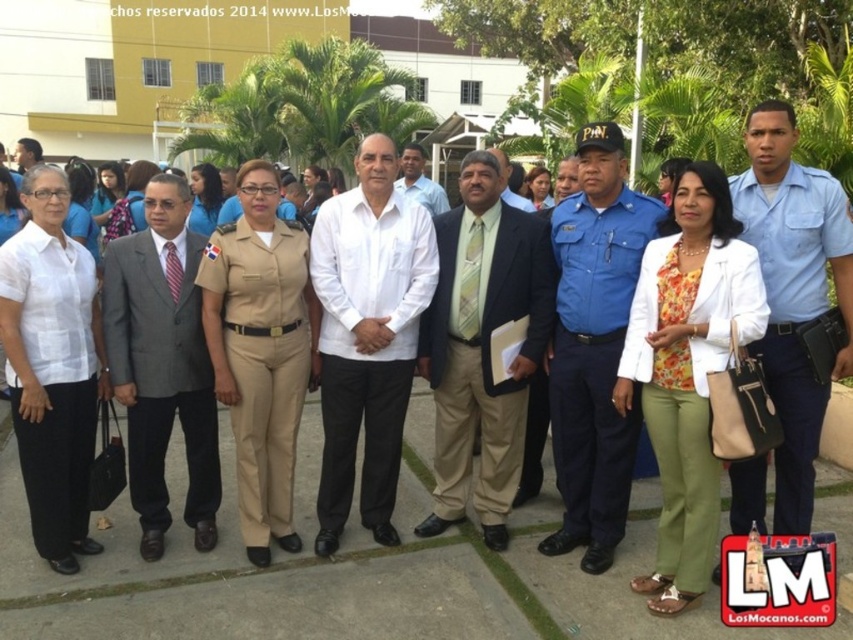
You are organizing a photo shoot and need to arrange the blue uniform at center and the gray suit at center in a row. Which of the two would require less space to place in the row?

The blue uniform at center occupies less space than the gray suit at center, so it would require less space to place in the row.